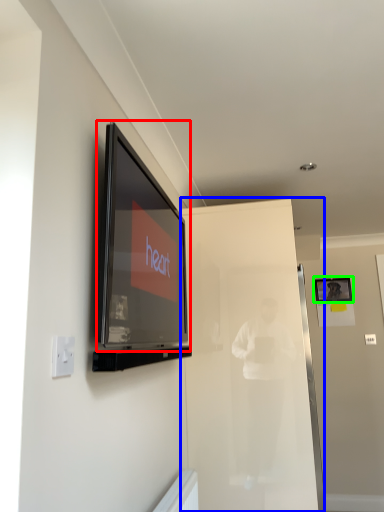
Question: Which is nearer to the television (highlighted by a red box)? glass door (highlighted by a blue box) or picture frame (highlighted by a green box).

Choices:
 (A) glass door
 (B) picture frame

Answer: (A)